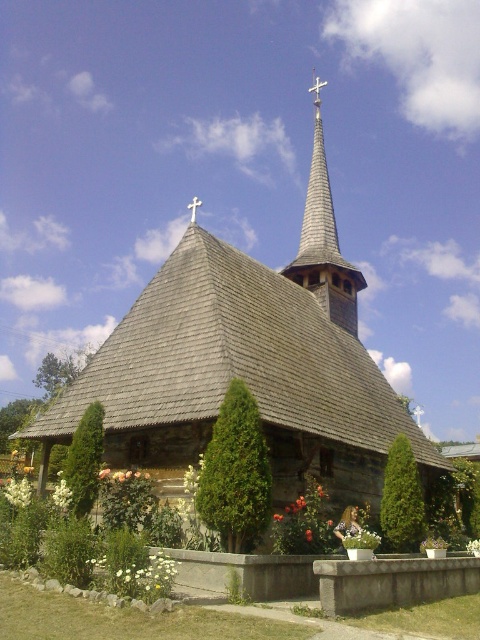
You are a gardener planning to plant a new bush in front of the church. The space available is exactly the size of the green textured bush at center. Can the wooden shingles at center currently occupying the space be replaced with a larger bush without exceeding the available area?

The wooden shingles at center are larger in size than the green textured bush at center. Therefore, replacing the wooden shingles at center with a larger bush would exceed the available space since the current shingles already occupy more area than the existing bush.

You are a gardener planning to water the green leafy bush at center and the wooden shingles at center. Since the water hose can only reach 50 feet, will you be able to water both without moving the hose?

The distance between the wooden shingles at center and the green leafy bush at center is 54.31 feet, which exceeds the 50 feet reach of the hose. Therefore, you will need to move the hose to water both.